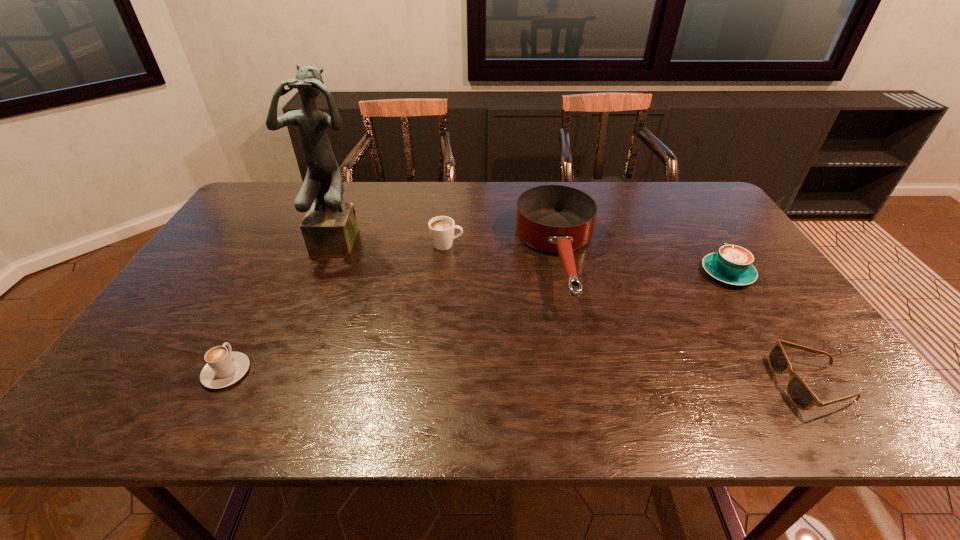
Locate an element on the screen. object that is positioned at the far edge is located at coordinates (559, 219).

This screenshot has height=540, width=960. Identify the location of cappuccino present at the near edge. (224, 368).

What are the coordinates of `sunglasses positioned at the near edge` in the screenshot? It's located at (799, 393).

The width and height of the screenshot is (960, 540). Identify the location of cappuccino that is at the right edge. (732, 264).

Where is `sunglasses that is at the right edge`? This screenshot has height=540, width=960. sunglasses that is at the right edge is located at coordinates (799, 393).

Where is `object positioned at the near right corner`? This screenshot has width=960, height=540. object positioned at the near right corner is located at coordinates (799, 393).

This screenshot has height=540, width=960. In the image, there is a desktop. Identify the location of free space at the far edge. (407, 217).

The image size is (960, 540). I want to click on free space at the near edge of the desktop, so click(677, 397).

I want to click on free space at the left edge of the desktop, so click(166, 338).

Locate an element on the screen. vacant region at the right edge is located at coordinates (800, 365).